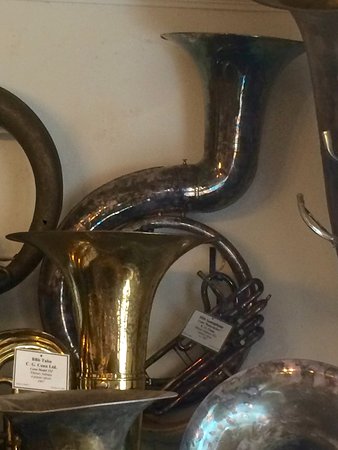
The height and width of the screenshot is (450, 338). Identify the location of wall trim. coord(235,12), coord(244,3).